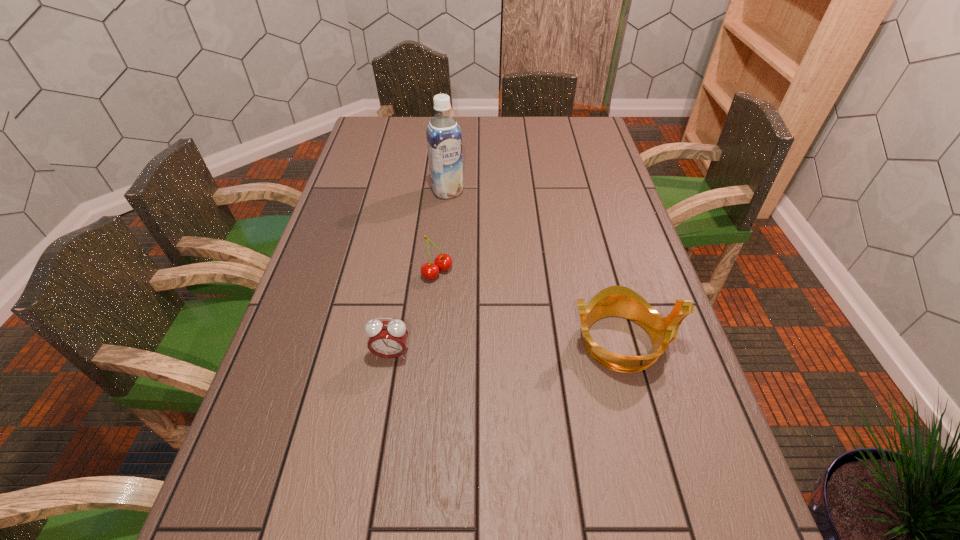
Find the location of `vacant space located 0.150m with the stems of the cherry pointing upwards`. vacant space located 0.150m with the stems of the cherry pointing upwards is located at coordinates (490, 310).

In order to click on vacant point located 0.100m with the stems of the cherry pointing upwards in this screenshot , I will do `click(475, 300)`.

This screenshot has width=960, height=540. Identify the location of object present at the right edge. (620, 301).

Find the location of a particular element. free location at the far edge of the desktop is located at coordinates (490, 120).

The width and height of the screenshot is (960, 540). Find the location of `free region at the near edge of the desktop`. free region at the near edge of the desktop is located at coordinates (392, 469).

Find the location of `vacant space at the left edge of the desktop`. vacant space at the left edge of the desktop is located at coordinates (251, 450).

The width and height of the screenshot is (960, 540). Identify the location of blank space at the right edge. (655, 362).

This screenshot has height=540, width=960. I want to click on vacant space at the near left corner, so click(283, 491).

This screenshot has height=540, width=960. Identify the location of blank region between the alarm clock and the rightmost object. [507, 348].

Find the location of `vacant region between the alarm clock and the cherry`. vacant region between the alarm clock and the cherry is located at coordinates (414, 313).